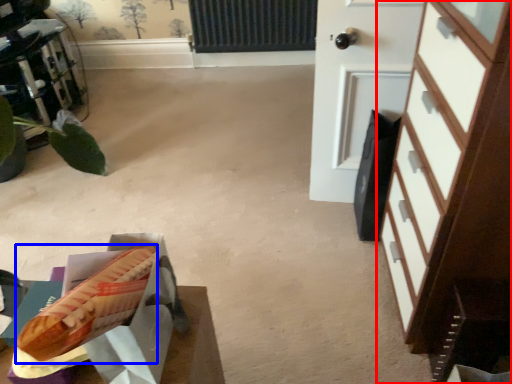
Question: Which object is further to the camera taking this photo, chest of drawers (highlighted by a red box) or hot dog (highlighted by a blue box)?

Choices:
 (A) chest of drawers
 (B) hot dog

Answer: (B)